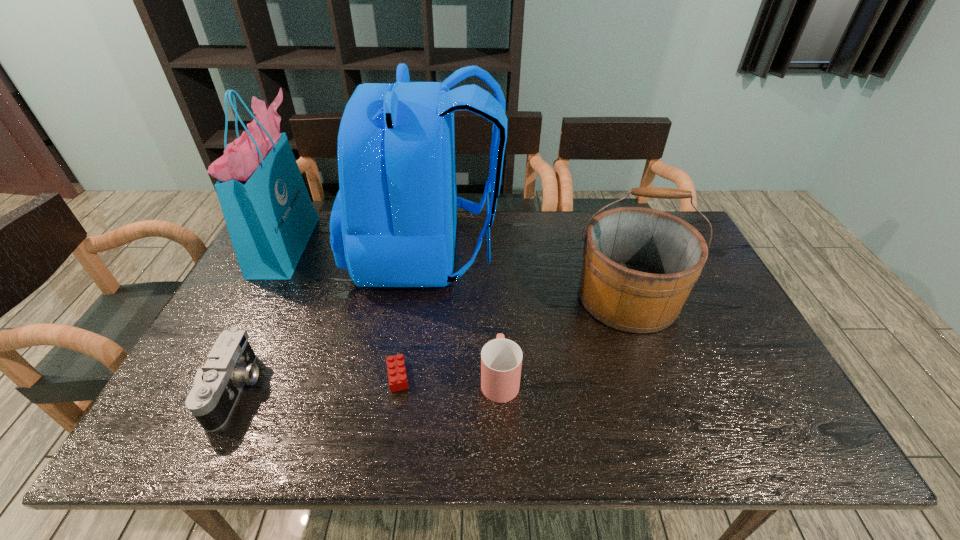
You are a GUI agent. You are given a task and a screenshot of the screen. Output one action in this format:
    pyautogui.click(x=<x>, y=<y>)
    Task: Click on the object at the right edge
    Image resolution: width=960 pixels, height=540 pixels.
    Given the screenshot: What is the action you would take?
    pyautogui.click(x=639, y=265)

At what (x,y) coordinates should I click in order to perform the action: click on object that is positioned at the far left corner. Please return your answer as a coordinate pair (x, y). The height and width of the screenshot is (540, 960). Looking at the image, I should click on (270, 217).

Locate an element on the screen. object located in the near left corner section of the desktop is located at coordinates (230, 364).

The image size is (960, 540). What are the coordinates of `vacant area at the far edge of the desktop` in the screenshot? It's located at (498, 215).

You are a GUI agent. You are given a task and a screenshot of the screen. Output one action in this format:
    pyautogui.click(x=<x>, y=<y>)
    Task: Click on the blank space at the near edge of the desktop
    The height and width of the screenshot is (540, 960).
    Given the screenshot: What is the action you would take?
    pyautogui.click(x=314, y=414)

Locate an element on the screen. vacant space at the left edge of the desktop is located at coordinates (225, 318).

Locate an element on the screen. The height and width of the screenshot is (540, 960). vacant space at the right edge of the desktop is located at coordinates (713, 379).

You are a GUI agent. You are given a task and a screenshot of the screen. Output one action in this format:
    pyautogui.click(x=<x>, y=<y>)
    Task: Click on the free location at the near left corner of the desktop
    
    Given the screenshot: What is the action you would take?
    pyautogui.click(x=181, y=452)

Find the location of `free area in between the shopping bag and the camera`. free area in between the shopping bag and the camera is located at coordinates (261, 316).

Where is `free space between the camera and the shortest object`? This screenshot has width=960, height=540. free space between the camera and the shortest object is located at coordinates (317, 383).